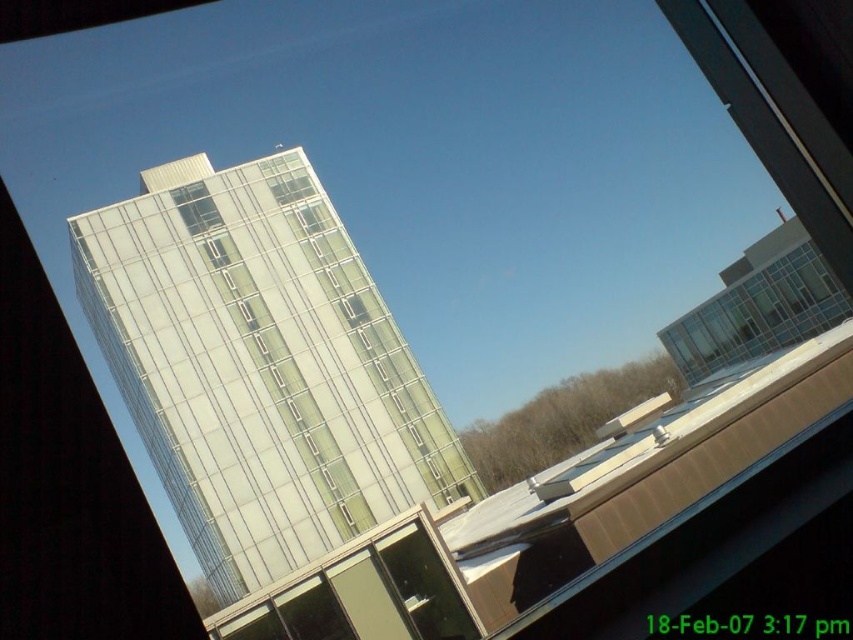
Between clear glass building at center and transparent glass window at upper right, which one appears on the left side from the viewer's perspective?

clear glass building at center

Does clear glass building at center appear under transparent glass window at upper right?

Yes, clear glass building at center is below transparent glass window at upper right.

Locate an element on the screen. The width and height of the screenshot is (853, 640). clear glass building at center is located at coordinates (259, 368).

Is point (793, 246) farther from viewer compared to point (291, 173)?

Yes.

Does transparent glass window at upper right have a larger size compared to clear glass window at upper center?

Indeed, transparent glass window at upper right has a larger size compared to clear glass window at upper center.

Is point (781, 328) closer to viewer compared to point (305, 177)?

No, it is not.

In order to click on transparent glass window at upper right in this screenshot , I will do `click(757, 308)`.

Between clear glass building at center and clear glass window at upper center, which one appears on the right side from the viewer's perspective?

From the viewer's perspective, clear glass window at upper center appears more on the right side.

Which is below, clear glass building at center or clear glass window at upper center?

clear glass building at center is lower down.

This screenshot has height=640, width=853. Find the location of `clear glass building at center`. clear glass building at center is located at coordinates (259, 368).